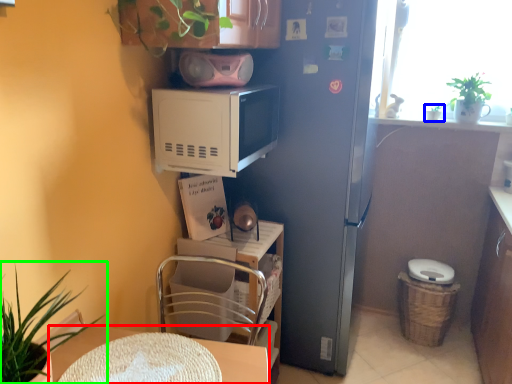
Question: Which object is the farthest from desk (highlighted by a red box)? Choose among these: houseplant (highlighted by a blue box) or houseplant (highlighted by a green box).

Choices:
 (A) houseplant
 (B) houseplant

Answer: (A)